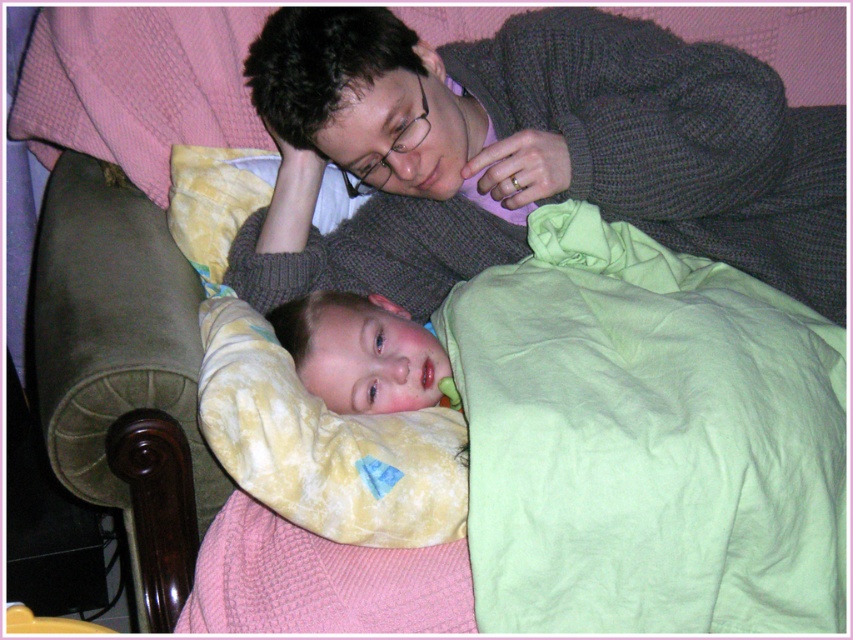
You are a photographer trying to capture the interaction between the two people in the image. You want to ensure the knitted dark gray sweater at upper center and the smooth green pillow at lower center are both visible in the frame. Based on their positions, which object should you focus on first to ensure both are in focus?

The knitted dark gray sweater at upper center is located above the smooth green pillow at lower center, so focusing on the sweater first will help ensure both objects are in focus as they are vertically aligned.

You are a tailor measuring clothing for a customer. You see the knitted dark gray sweater at upper center and the smooth green pillow at lower center in the image. Which item is taller?

The knitted dark gray sweater at upper center is much taller than the smooth green pillow at lower center.